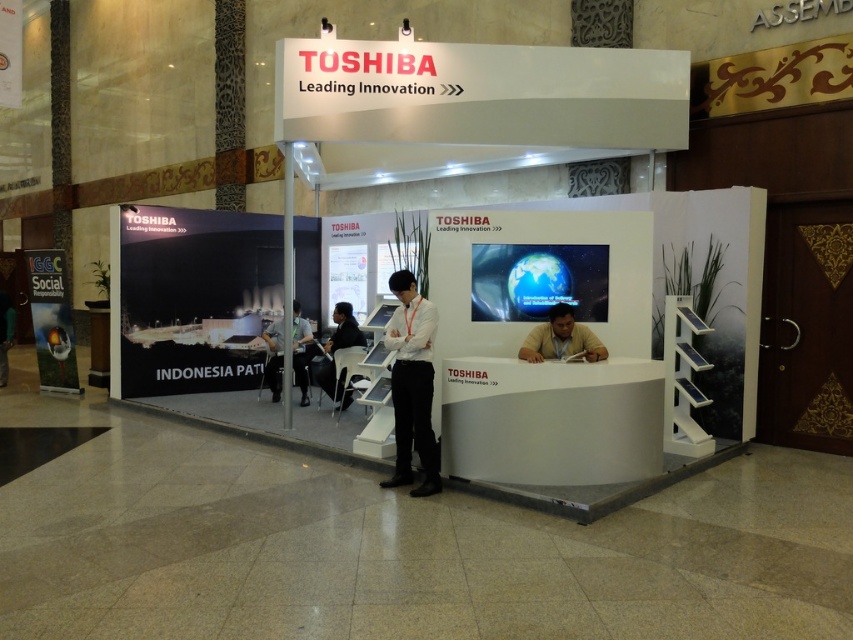
You are a photographer at the event and want to capture a photo of the white fabric shirt at center and the black fabric chair at center. Which object should you focus on if you want to ensure the wider object is in sharp focus?

You should focus on the white fabric shirt at center because it might be wider than the black fabric chair at center.

You are a visitor at the Toshiba exhibition booth and want to sit down to read the materials on the white smooth desk at center. Is the black fabric chair at center positioned in a way that allows you to easily access the desk?

The white smooth desk at center is in front of the black fabric chair at center, so the chair is behind the desk. This means the chair is positioned for someone to sit facing the desk, allowing easy access to the materials on it.